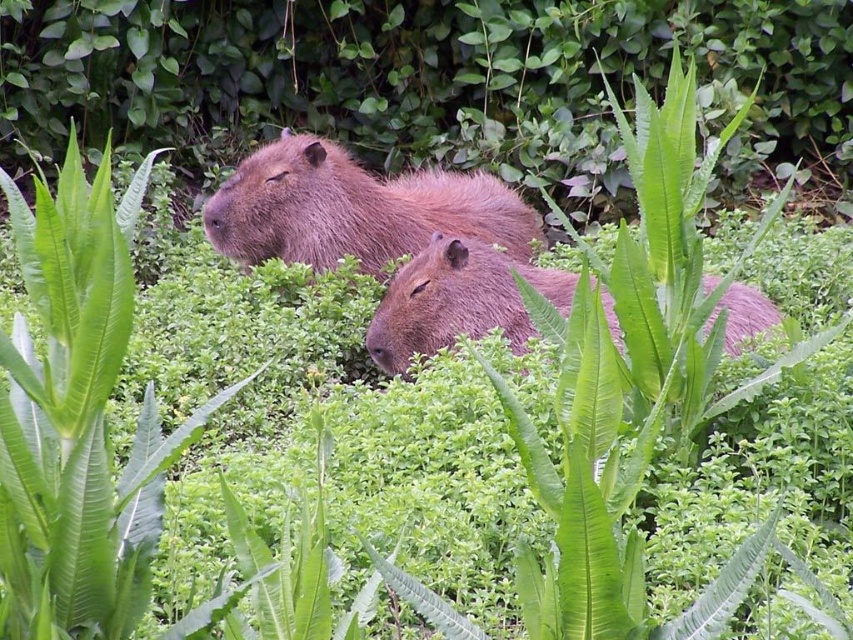
Question: Which point is farther to the camera?

Choices:
 (A) (376, 362)
 (B) (505, 220)

Answer: (B)

Question: Is brown furry capybara at center thinner than fuzzy brown capybara at center?

Choices:
 (A) no
 (B) yes

Answer: (A)

Question: In this image, where is brown furry capybara at center located relative to fuzzy brown capybara at center?

Choices:
 (A) above
 (B) below

Answer: (A)

Question: Does brown furry capybara at center have a larger size compared to fuzzy brown capybara at center?

Choices:
 (A) yes
 (B) no

Answer: (A)

Question: Which point is farther to the camera?

Choices:
 (A) brown furry capybara at center
 (B) fuzzy brown capybara at center

Answer: (A)

Question: Which point appears closest to the camera in this image?

Choices:
 (A) (283, 176)
 (B) (610, 321)

Answer: (B)